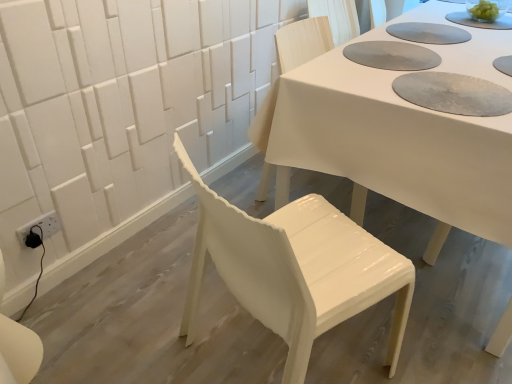
Question: Is white glossy chair at center, the 1th chair viewed from the back, taller or shorter than white glossy chair at center, the second chair positioned from the back?

Choices:
 (A) short
 (B) tall

Answer: (B)

Question: From the image's perspective, is white glossy chair at center, the 1th chair viewed from the back, positioned above or below white glossy chair at center, the second chair positioned from the back?

Choices:
 (A) below
 (B) above

Answer: (B)

Question: Based on their relative distances, which object is nearer to the white glossy chair at center, which ranks as the first chair in front-to-back order?

Choices:
 (A) white glossy chair at center, the 2th chair in the front-to-back sequence
 (B) textured gray paper plate at upper center
 (C) white glossy table at center

Answer: (C)

Question: Estimate the real-world distances between objects in this image. Which object is closer to the white glossy table at center?

Choices:
 (A) textured gray paper plate at upper center
 (B) white glossy chair at center, the 1th chair viewed from the back
 (C) white glossy chair at center, the second chair positioned from the back

Answer: (A)